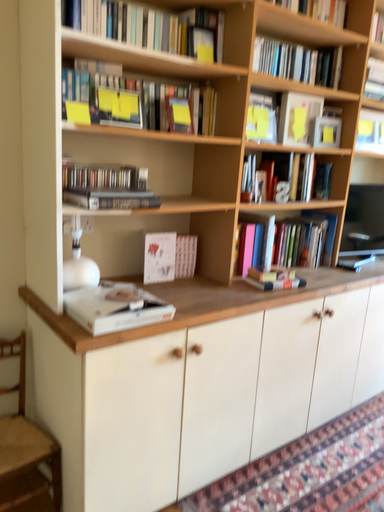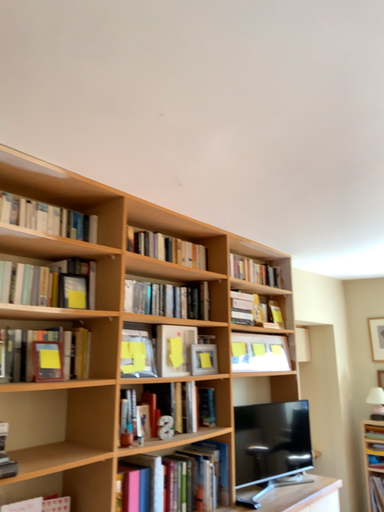
Question: Which way did the camera rotate in the video?

Choices:
 (A) rotated upward
 (B) rotated downward

Answer: (A)